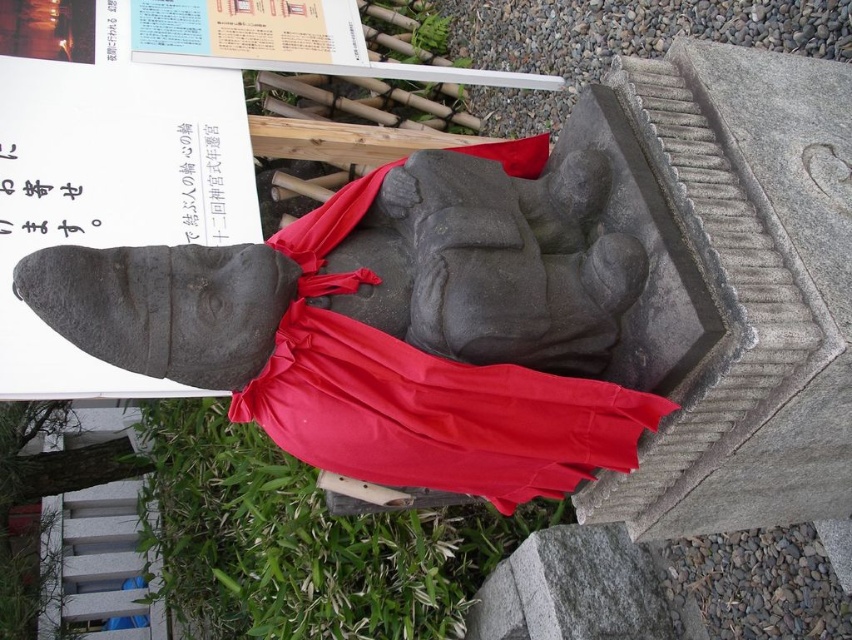
Looking at this image, who is shorter, black paper at upper left or black paper at upper center?

With less height is black paper at upper left.

How distant is black paper at upper left from black paper at upper center?

The distance of black paper at upper left from black paper at upper center is 13.19 inches.

Between point (30, 193) and point (193, 172), which one is positioned in front?

Point (30, 193) is more forward.

Locate an element on the screen. The width and height of the screenshot is (852, 640). black paper at upper left is located at coordinates (45, 192).

Looking at this image, is red fabric at center positioned behind black paper at upper left?

No, it is in front of black paper at upper left.

Can you confirm if red fabric at center is bigger than black paper at upper left?

Yes.

This screenshot has height=640, width=852. What do you see at coordinates (424, 392) in the screenshot? I see `red fabric at center` at bounding box center [424, 392].

Locate an element on the screen. The width and height of the screenshot is (852, 640). red fabric at center is located at coordinates (424, 392).

Between red fabric at center and black paper at upper center, which one is positioned lower?

red fabric at center

Who is positioned more to the left, red fabric at center or black paper at upper center?

From the viewer's perspective, black paper at upper center appears more on the left side.

Which is in front, point (323, 228) or point (217, 173)?

Positioned in front is point (323, 228).

At what (x,y) coordinates should I click in order to perform the action: click on red fabric at center. Please return your answer as a coordinate pair (x, y). The height and width of the screenshot is (640, 852). Looking at the image, I should click on (424, 392).